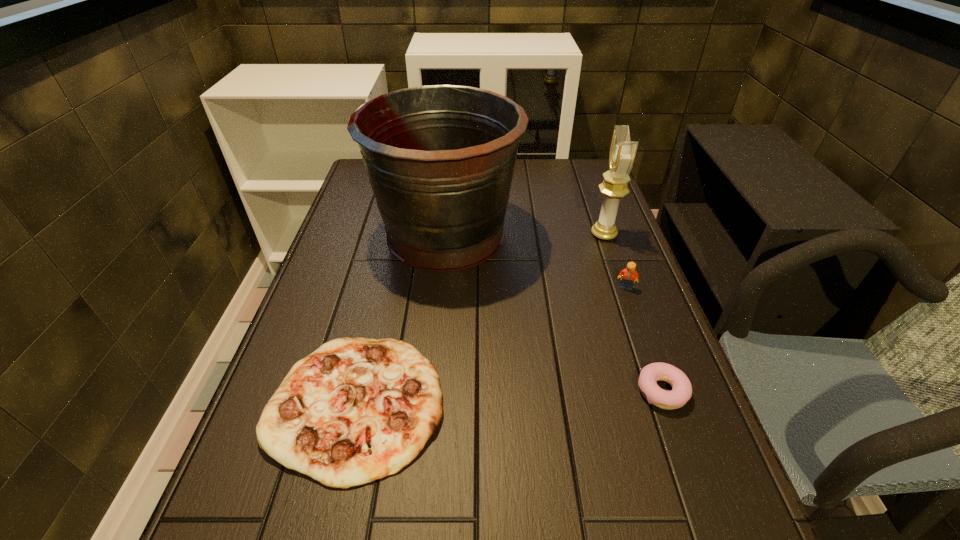
Identify the location of empty space between the doughnut and the fourth shortest object. The image size is (960, 540). (633, 313).

Where is `unoccupied area between the fourth shortest object and the pizza`? unoccupied area between the fourth shortest object and the pizza is located at coordinates coord(480,319).

Identify which object is the nearest to the pizza. Please provide its 2D coordinates. Your answer should be formatted as a tuple, i.e. [(x, y)], where the tuple contains the x and y coordinates of a point satisfying the conditions above.

[(440, 159)]

In order to click on object that is the fourth closest to the doughnut in this screenshot , I will do pyautogui.click(x=622, y=153).

Identify the location of vacant space that satisfies the following two spatial constraints: 1. on the back side of the bucket; 2. on the left side of the pizza. Image resolution: width=960 pixels, height=540 pixels. (396, 234).